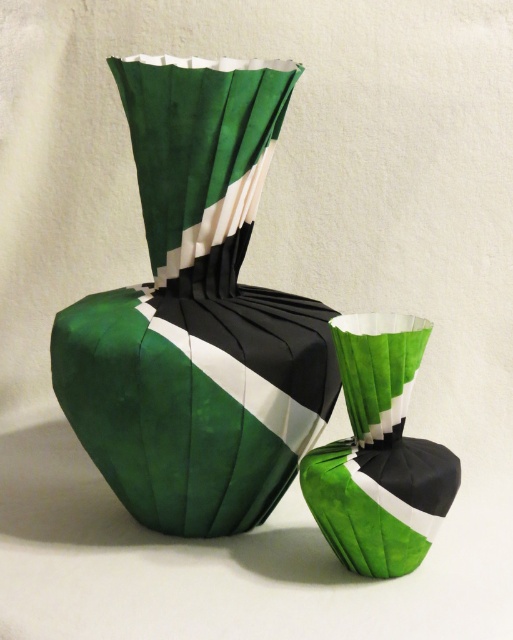
You are an interior designer planning to place a decorative item on a shelf. You have a green paper vase at center. Where should you place it on the shelf to match its current position in the image?

The green paper vase at center should be placed at point (198, 314) on the shelf to match its current position in the image.